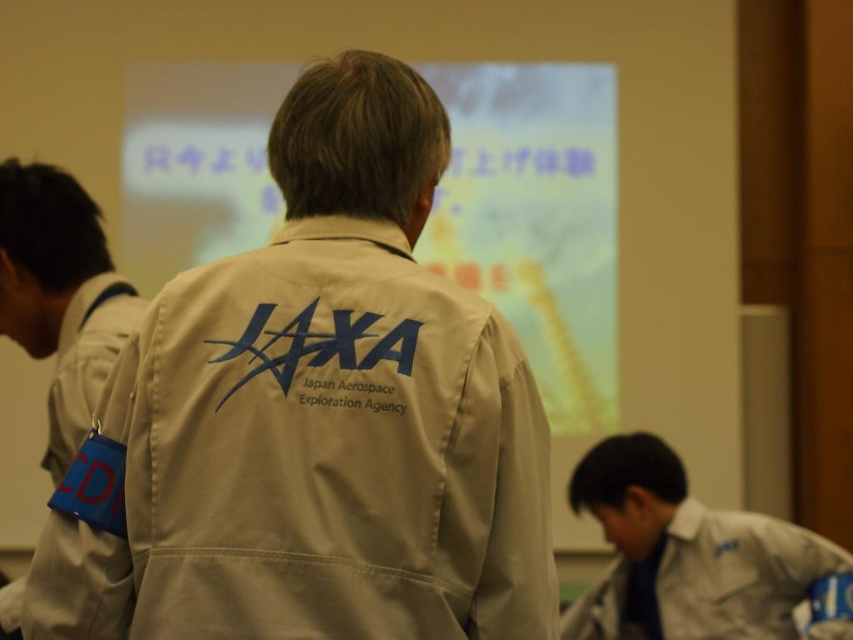
Based on the photo, does matte white projection screen at center have a greater height compared to beige fabric jaxa jacket at center?

Yes, matte white projection screen at center is taller than beige fabric jaxa jacket at center.

Which is in front, point (155, 225) or point (13, 602)?

Positioned in front is point (13, 602).

You are a GUI agent. You are given a task and a screenshot of the screen. Output one action in this format:
    pyautogui.click(x=<x>, y=<y>)
    Task: Click on the matte white projection screen at center
    This screenshot has height=640, width=853.
    Given the screenshot: What is the action you would take?
    pyautogui.click(x=537, y=220)

Which is more to the right, beige fabric uniform at lower right or beige fabric jaxa jacket at center?

From the viewer's perspective, beige fabric uniform at lower right appears more on the right side.

Is beige fabric uniform at lower right positioned at the back of beige fabric jaxa jacket at center?

Yes, it is.

This screenshot has height=640, width=853. What do you see at coordinates (685, 554) in the screenshot?
I see `beige fabric uniform at lower right` at bounding box center [685, 554].

Where is `beige fabric uniform at lower right`? beige fabric uniform at lower right is located at coordinates (685, 554).

Can you confirm if beige fabric lab coat at center is positioned to the right of beige fabric jaxa jacket at center?

Indeed, beige fabric lab coat at center is positioned on the right side of beige fabric jaxa jacket at center.

Consider the image. Who is more distant from viewer, (314, 419) or (33, 326)?

Point (33, 326)

Where is `beige fabric lab coat at center`? beige fabric lab coat at center is located at coordinates (314, 460).